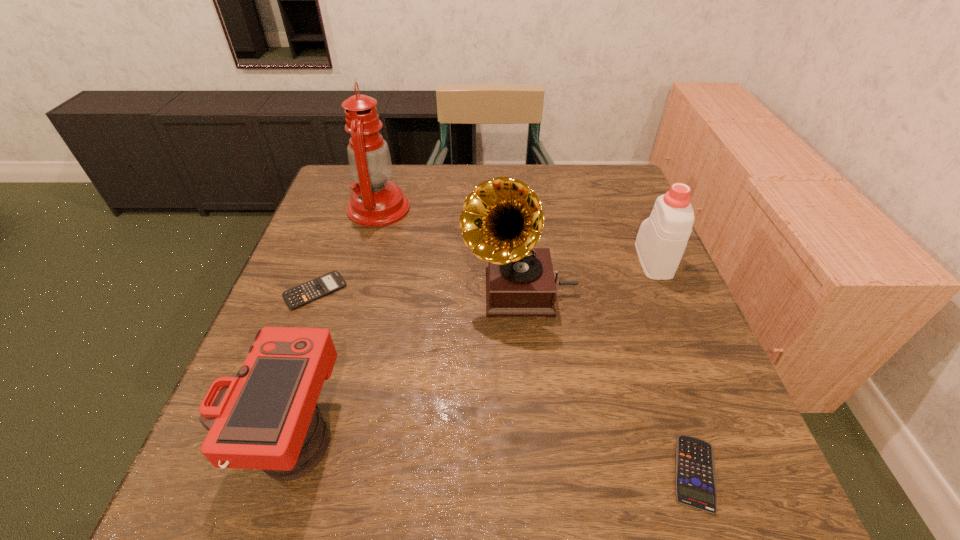
Image resolution: width=960 pixels, height=540 pixels. I want to click on vacant space at the far edge of the desktop, so click(409, 173).

Identify the location of blank space at the left edge. The height and width of the screenshot is (540, 960). (342, 224).

The height and width of the screenshot is (540, 960). I want to click on vacant region at the right edge, so click(x=646, y=304).

Identify the location of vacant space at the far left corner of the desktop. coord(337,200).

Where is `free space at the near right corner of the desktop`? free space at the near right corner of the desktop is located at coordinates (723, 497).

The image size is (960, 540). I want to click on unoccupied area between the oil lamp and the phonograph record, so [449, 249].

Find the location of `vacant area that lies between the phonograph record and the detergent`. vacant area that lies between the phonograph record and the detergent is located at coordinates (587, 275).

Identify the location of vacant point located between the camera and the detergent. [473, 347].

Where is `free space between the camera and the oil lamp`? Image resolution: width=960 pixels, height=540 pixels. free space between the camera and the oil lamp is located at coordinates (336, 321).

Find the location of a particular element. Image resolution: width=960 pixels, height=540 pixels. free area in between the fifth shortest object and the fourth tallest object is located at coordinates (406, 362).